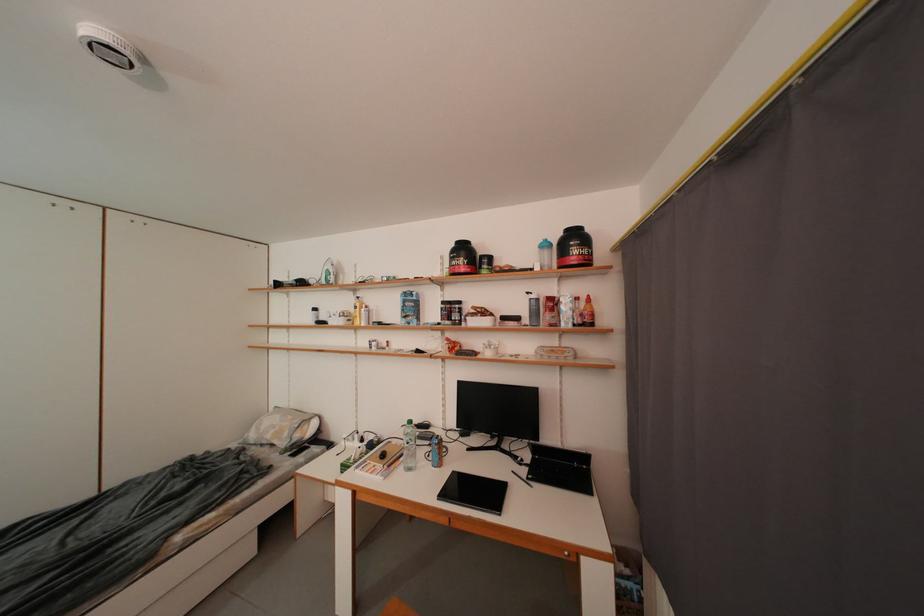
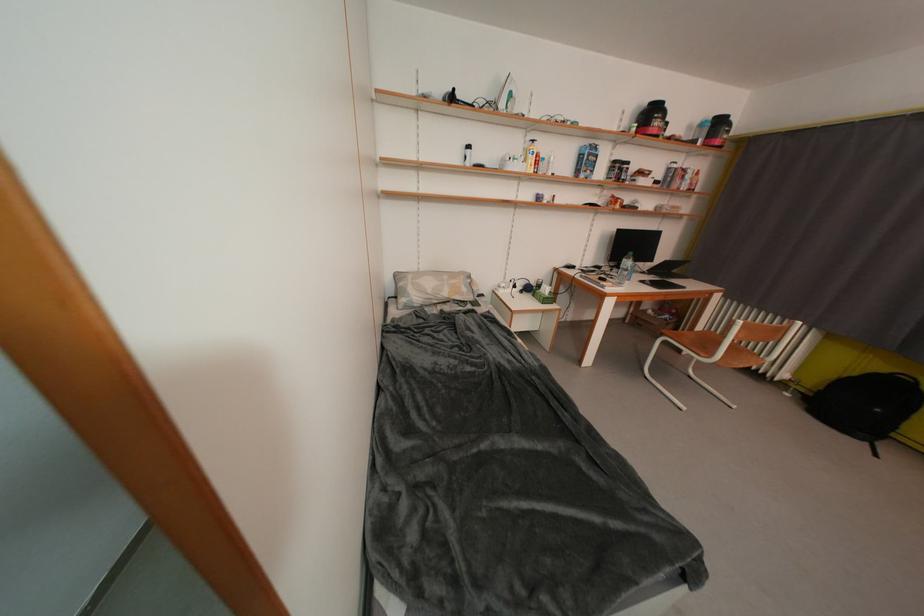
Where in the second image is the point corresponding to (x=286, y=288) from the first image?

(459, 100)